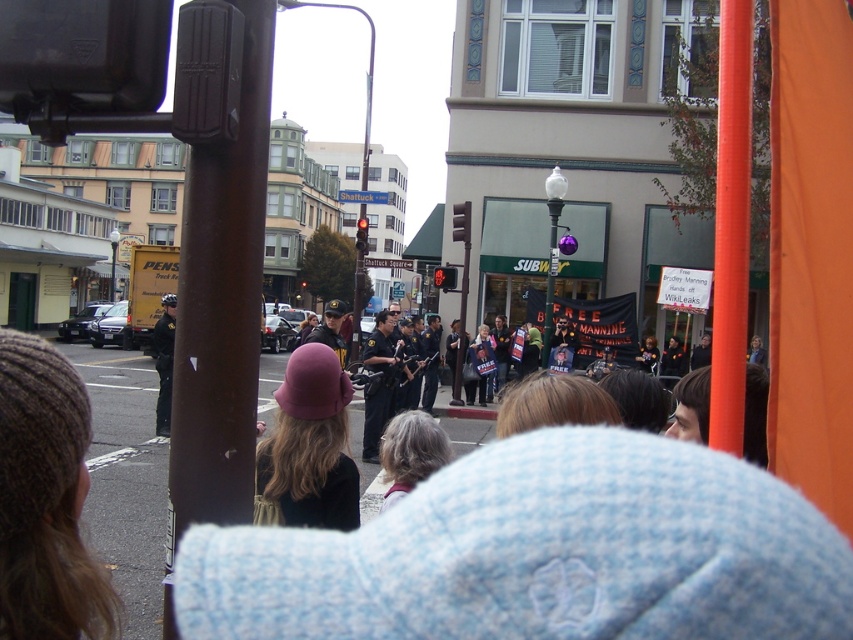
Question: Which point is closer to the camera?

Choices:
 (A) (252, 458)
 (B) (744, 129)
 (C) (436, 461)

Answer: (B)

Question: Does brown hair at center appear on the left side of dark blue uniform at center?

Choices:
 (A) yes
 (B) no

Answer: (B)

Question: In this image, where is brown hair at center located relative to dark blue uniform at center?

Choices:
 (A) right
 (B) left

Answer: (A)

Question: Which is nearer to the knitted brown hat at left?

Choices:
 (A) dark blue uniform at center
 (B) matte purple hat at center

Answer: (B)

Question: From the image, what is the correct spatial relationship of matte purple hat at center in relation to gray hair at center?

Choices:
 (A) right
 (B) left

Answer: (B)

Question: Which point appears closest to the camera in this image?

Choices:
 (A) (733, 189)
 (B) (264, 24)
 (C) (50, 358)

Answer: (C)